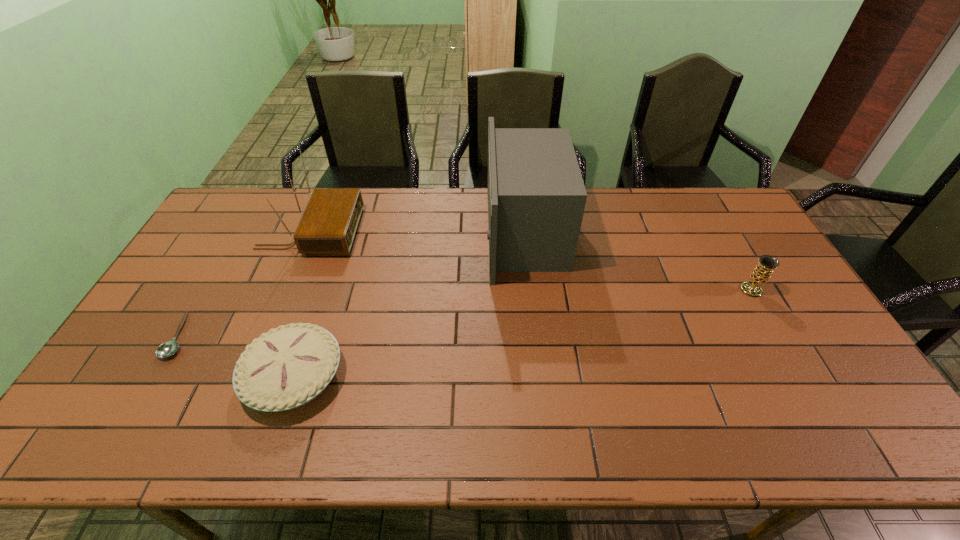
I want to click on free region at the near edge, so click(285, 436).

I want to click on free region at the left edge, so click(x=118, y=367).

In the image, there is a desktop. Identify the location of free region at the right edge. The image size is (960, 540). (805, 396).

Locate an element on the screen. blank space at the far left corner is located at coordinates (244, 205).

Where is `vacant space in between the second tallest object and the ladle`? vacant space in between the second tallest object and the ladle is located at coordinates (245, 284).

Where is `unoccupied area between the fourth object from left to right and the ladle`? unoccupied area between the fourth object from left to right and the ladle is located at coordinates (352, 285).

Find the location of `unoccupied area between the second object from right to left and the leftmost object`. unoccupied area between the second object from right to left and the leftmost object is located at coordinates (352, 285).

Where is `vacant area between the radio_receiver and the microwave oven`? vacant area between the radio_receiver and the microwave oven is located at coordinates (418, 233).

The width and height of the screenshot is (960, 540). In order to click on free space between the second object from right to left and the pie in this screenshot , I will do `click(410, 305)`.

Locate an element on the screen. The image size is (960, 540). vacant area that lies between the leftmost object and the rightmost object is located at coordinates (466, 313).